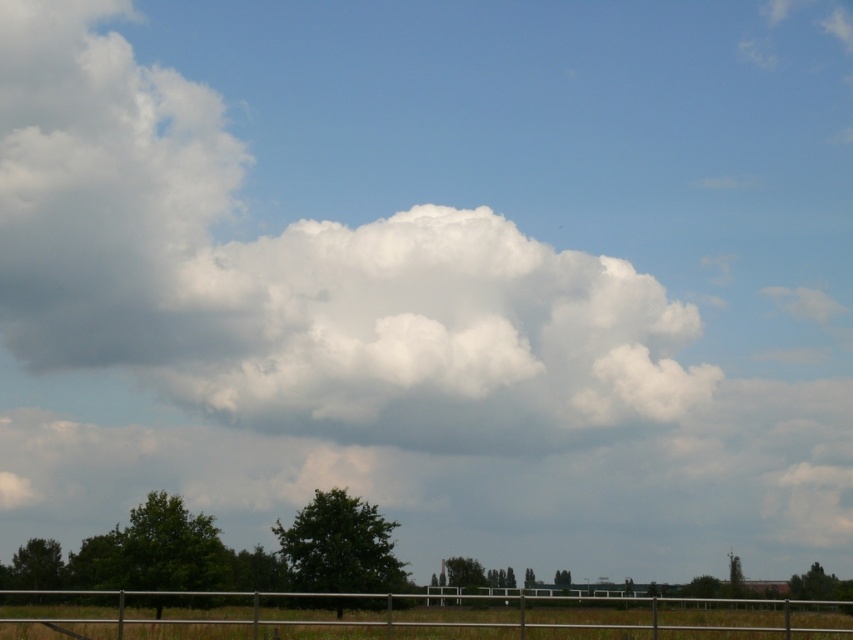
You are standing in the field looking at the white fluffy cloud at upper center and the silver metallic fence at lower center. Which object appears wider in the image?

The white fluffy cloud at upper center appears wider than the silver metallic fence at lower center because its width is larger.

In the scene shown: You are standing at the point closest to the viewer in the image. Which point, point (421, 269) or point (828, 604), is farther away from you?

Point (421, 269) is farther away because it is behind point (828, 604).

You are an artist trying to paint the scene. You want to ensure the white fluffy cloud at upper center and the silver metallic fence at lower center are proportionally accurate. Which object should you paint to be bigger?

The white fluffy cloud at upper center should be painted bigger because it is larger in size than the silver metallic fence at lower center according to the description.